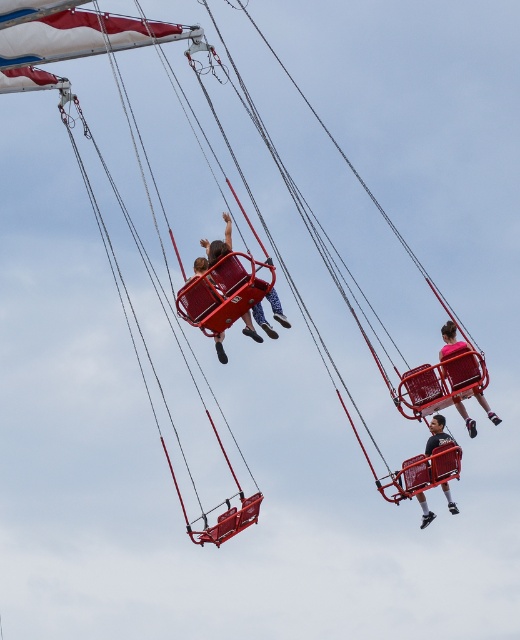
You are a safety inspector checking the distance between the matte red swing at center and the matte black helmet at center. According to safety regulations, the minimum safe distance between any ride component and a helmet must be at least 10 meters. Is the current distance compliant with the regulations?

The matte red swing at center and the matte black helmet at center are 13.48 meters apart, which exceeds the minimum required distance of 10 meters. Therefore, the current distance is compliant with safety regulations.

You are standing at the entrance of the fairground and see the matte red swing at center. If you want to take a photo of it with your phone, which has a maximum zoom range of 10 meters, will you be able to capture the entire swing ride clearly without moving closer?

The matte red swing at center and camera are 57.21 meters apart, which is beyond the 10 meter maximum zoom range of your phone. Therefore, you will not be able to capture the entire swing ride clearly without moving closer.